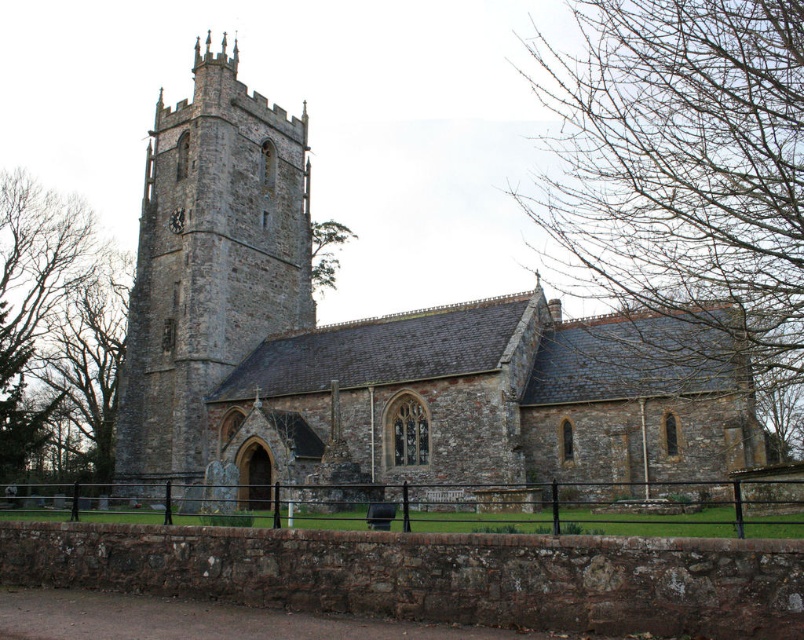
Question: Which is nearer to the brown leafless tree at left?

Choices:
 (A) stone tower at center-left
 (B) green leafy tree at upper center

Answer: (A)

Question: Which point is farther from the camera taking this photo?

Choices:
 (A) (651, 241)
 (B) (5, 509)
 (C) (11, 202)
 (D) (163, 413)

Answer: (C)

Question: Is bare branches at upper right below stone tower at center-left?

Choices:
 (A) no
 (B) yes

Answer: (A)

Question: Can you confirm if stone church at center is positioned above bare branches at upper right?

Choices:
 (A) yes
 (B) no

Answer: (B)

Question: Does brown leafless tree at left appear on the left side of green leafy tree at upper center?

Choices:
 (A) no
 (B) yes

Answer: (B)

Question: Which point is closer to the camera taking this photo?

Choices:
 (A) (48, 378)
 (B) (241, 380)

Answer: (B)